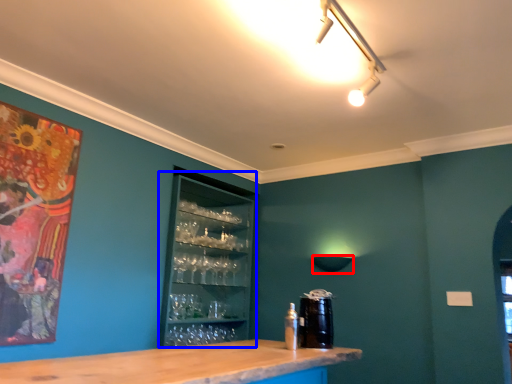
Question: Which object is further to the camera taking this photo, lamp (highlighted by a red box) or drink (highlighted by a blue box)?

Choices:
 (A) lamp
 (B) drink

Answer: (A)